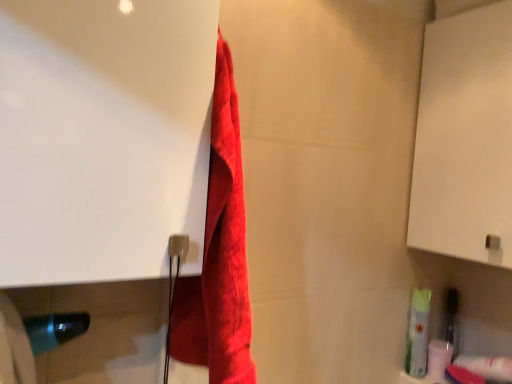
Question: Does white glossy screen door at upper left, the second screen door in the right-to-left sequence, have a lesser height compared to white matte toilet paper at lower right, arranged as the first toilet paper when viewed from the back?

Choices:
 (A) no
 (B) yes

Answer: (A)

Question: Does white glossy screen door at upper left, the second screen door in the right-to-left sequence, have a smaller size compared to white matte toilet paper at lower right, the 2th toilet paper viewed from the front?

Choices:
 (A) yes
 (B) no

Answer: (B)

Question: Is white glossy screen door at upper left, the second screen door in the right-to-left sequence, turned away from white matte toilet paper at lower right, the 2th toilet paper viewed from the front?

Choices:
 (A) yes
 (B) no

Answer: (B)

Question: Is white glossy screen door at upper left, arranged as the second screen door when viewed from the back, positioned in front of white matte toilet paper at lower right, arranged as the first toilet paper when viewed from the back?

Choices:
 (A) yes
 (B) no

Answer: (A)

Question: From the image's perspective, is white glossy screen door at upper left, the second screen door in the right-to-left sequence, on top of white matte toilet paper at lower right, arranged as the first toilet paper when viewed from the back?

Choices:
 (A) no
 (B) yes

Answer: (B)

Question: From their relative heights in the image, would you say white matte toilet paper at lower right, the 2th toilet paper viewed from the front, is taller or shorter than white matte cabinet at upper right, the 2th screen door positioned from the left?

Choices:
 (A) short
 (B) tall

Answer: (A)

Question: From the image's perspective, is white matte toilet paper at lower right, the 2th toilet paper viewed from the front, located above or below white matte cabinet at upper right, which appears as the first screen door when viewed from the back?

Choices:
 (A) above
 (B) below

Answer: (B)

Question: Looking at their shapes, would you say white matte toilet paper at lower right, arranged as the first toilet paper when viewed from the back, is wider or thinner than white matte cabinet at upper right, the first screen door from the right?

Choices:
 (A) wide
 (B) thin

Answer: (B)

Question: Considering the positions of white matte toilet paper at lower right, arranged as the first toilet paper when viewed from the back, and white matte cabinet at upper right, which appears as the first screen door when viewed from the back, in the image, is white matte toilet paper at lower right, arranged as the first toilet paper when viewed from the back, bigger or smaller than white matte cabinet at upper right, which appears as the first screen door when viewed from the back,?

Choices:
 (A) big
 (B) small

Answer: (B)

Question: Is white matte cabinet at upper right, which appears as the first screen door when viewed from the back, inside the boundaries of white glossy screen door at upper left, which is counted as the 1th screen door, starting from the left, or outside?

Choices:
 (A) inside
 (B) outside

Answer: (B)

Question: Does point (480, 152) appear closer or farther from the camera than point (36, 168)?

Choices:
 (A) closer
 (B) farther

Answer: (B)

Question: In terms of width, does white matte cabinet at upper right, which is the 2th screen door from front to back, look wider or thinner when compared to white glossy screen door at upper left, which ranks as the first screen door in front-to-back order?

Choices:
 (A) thin
 (B) wide

Answer: (A)

Question: From a real-world perspective, is white matte cabinet at upper right, the 2th screen door positioned from the left, above or below white glossy screen door at upper left, which ranks as the first screen door in front-to-back order?

Choices:
 (A) above
 (B) below

Answer: (A)

Question: Considering the positions of white glossy screen door at upper left, which ranks as the first screen door in front-to-back order, and white matte toilet paper at lower right, arranged as the first toilet paper when viewed from the back, in the image, is white glossy screen door at upper left, which ranks as the first screen door in front-to-back order, bigger or smaller than white matte toilet paper at lower right, arranged as the first toilet paper when viewed from the back,?

Choices:
 (A) big
 (B) small

Answer: (A)

Question: Would you say white glossy screen door at upper left, which is counted as the 1th screen door, starting from the left, is to the left or to the right of white matte toilet paper at lower right, arranged as the first toilet paper when viewed from the back, in the picture?

Choices:
 (A) left
 (B) right

Answer: (A)